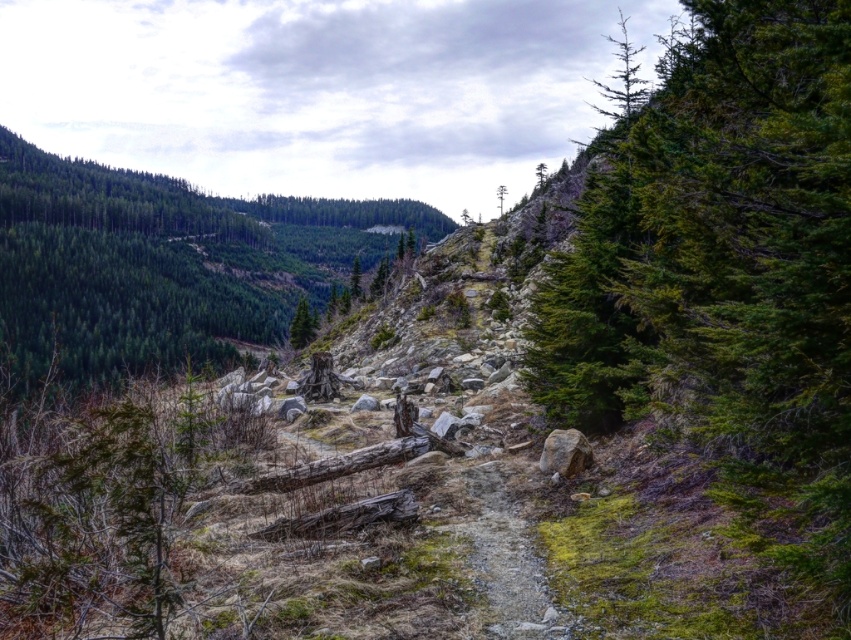
Question: Which of the following is the closest to the observer?

Choices:
 (A) (768, 118)
 (B) (545, 616)

Answer: (B)

Question: Does green textured tree at right appear on the right side of dirt path at center?

Choices:
 (A) no
 (B) yes

Answer: (B)

Question: Which of these objects is positioned farthest from the green textured tree at right?

Choices:
 (A) green matte tree at center
 (B) dirt path at center
 (C) green matte tree at upper left

Answer: (C)

Question: Can you confirm if green matte tree at upper left is positioned above green matte tree at center?

Choices:
 (A) no
 (B) yes

Answer: (B)

Question: Can you confirm if green matte tree at upper left is thinner than green matte tree at center?

Choices:
 (A) yes
 (B) no

Answer: (B)

Question: Which point appears farthest from the camera in this image?

Choices:
 (A) (298, 308)
 (B) (810, 333)
 (C) (513, 547)
 (D) (44, 273)

Answer: (D)